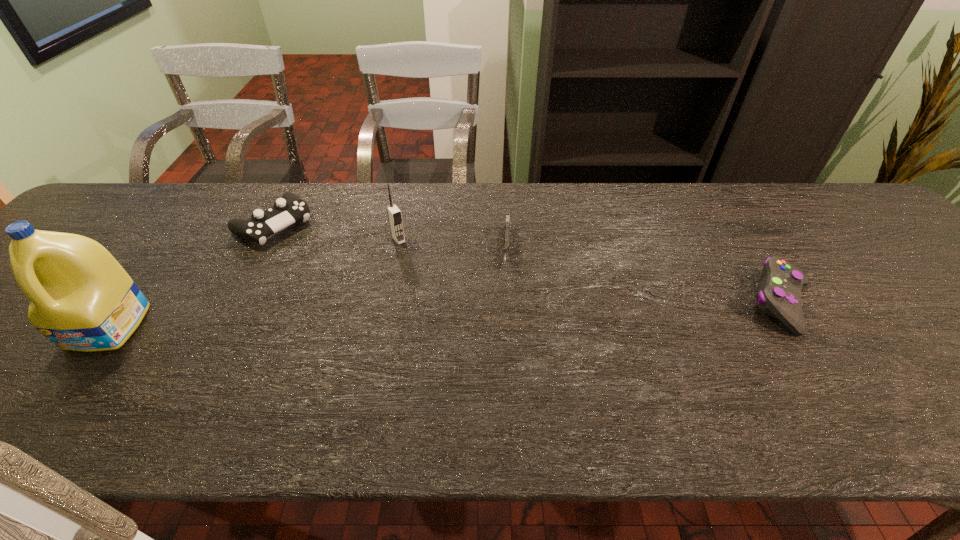
The width and height of the screenshot is (960, 540). Find the location of `detergent`. detergent is located at coordinates (82, 299).

Identify the location of the leftmost object. The width and height of the screenshot is (960, 540). (82, 299).

Identify the location of the rightmost object. pos(779,295).

Find the location of a particular element. This screenshot has height=540, width=960. the nearer control is located at coordinates (779, 295).

You are a GUI agent. You are given a task and a screenshot of the screen. Output one action in this format:
    pyautogui.click(x=<x>, y=<y>)
    Task: Click on the shortest object
    
    Given the screenshot: What is the action you would take?
    pos(507,225)

In order to click on gun in this screenshot , I will do `click(507, 225)`.

What are the coordinates of `cellular telephone` in the screenshot? It's located at (394, 214).

Identify the location of the second tallest object. This screenshot has width=960, height=540. (394, 214).

I want to click on the fourth object from right to left, so click(x=289, y=209).

I want to click on the farther control, so click(x=289, y=209).